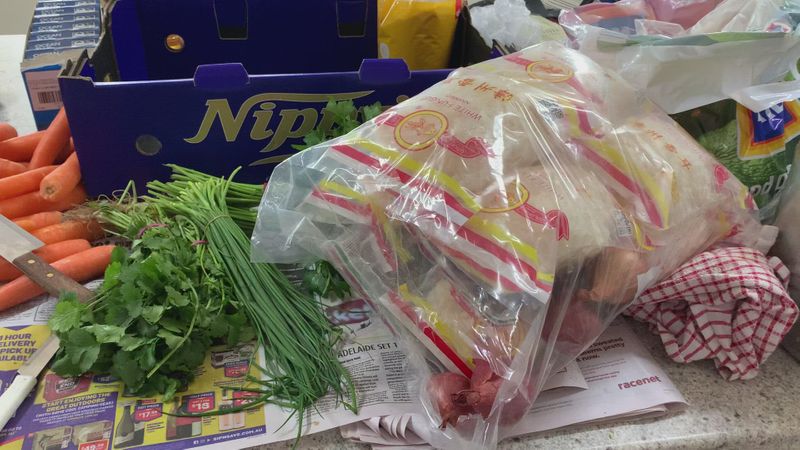
The image size is (800, 450). I want to click on checkered cloth, so click(745, 315), click(708, 295).